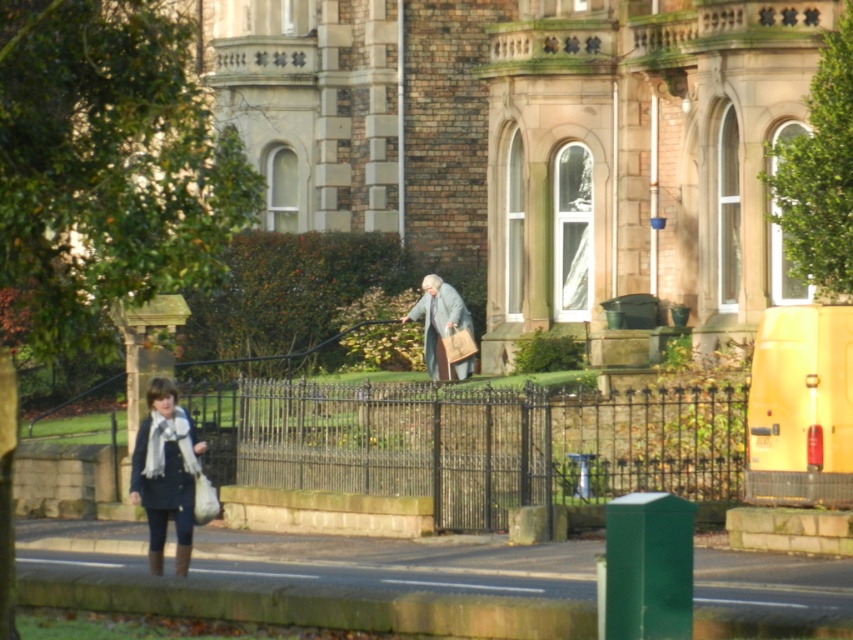
Question: Among these objects, which one is nearest to the camera?

Choices:
 (A) light gray woolen robe at center
 (B) knitted wool scarf at lower left
 (C) green stone pavement at lower center

Answer: (C)

Question: Can you confirm if green stone pavement at lower center is positioned to the right of light gray woolen robe at center?

Choices:
 (A) yes
 (B) no

Answer: (B)

Question: Estimate the real-world distances between objects in this image. Which object is closer to the knitted wool scarf at lower left?

Choices:
 (A) light gray woolen robe at center
 (B) green stone pavement at lower center

Answer: (B)

Question: Is green stone pavement at lower center closer to the viewer compared to light gray woolen robe at center?

Choices:
 (A) no
 (B) yes

Answer: (B)

Question: Among these objects, which one is nearest to the camera?

Choices:
 (A) green stone pavement at lower center
 (B) light gray woolen robe at center

Answer: (A)

Question: Where is green stone pavement at lower center located in relation to knitted wool scarf at lower left in the image?

Choices:
 (A) below
 (B) above

Answer: (A)